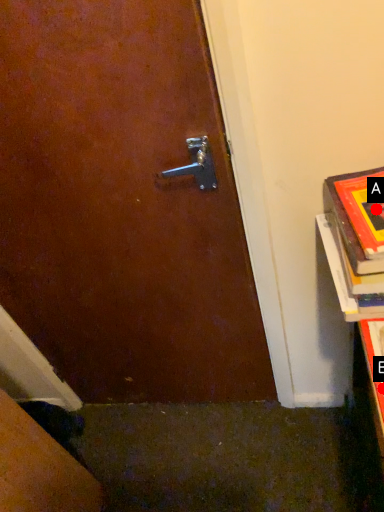
Question: Two points are circled on the image, labeled by A and B beside each circle. Which of the following is the farthest from the observer?

Choices:
 (A) A is further
 (B) B is further

Answer: (B)